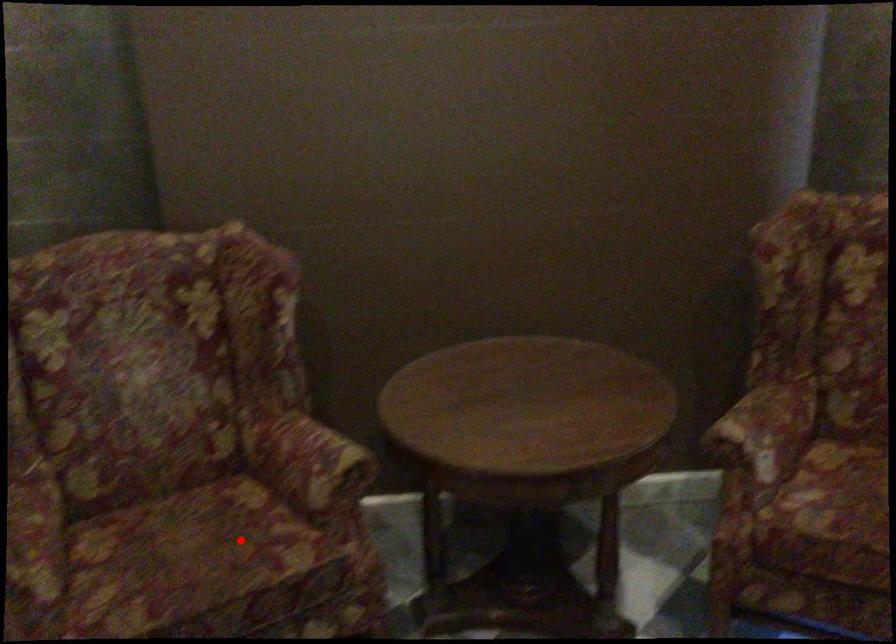
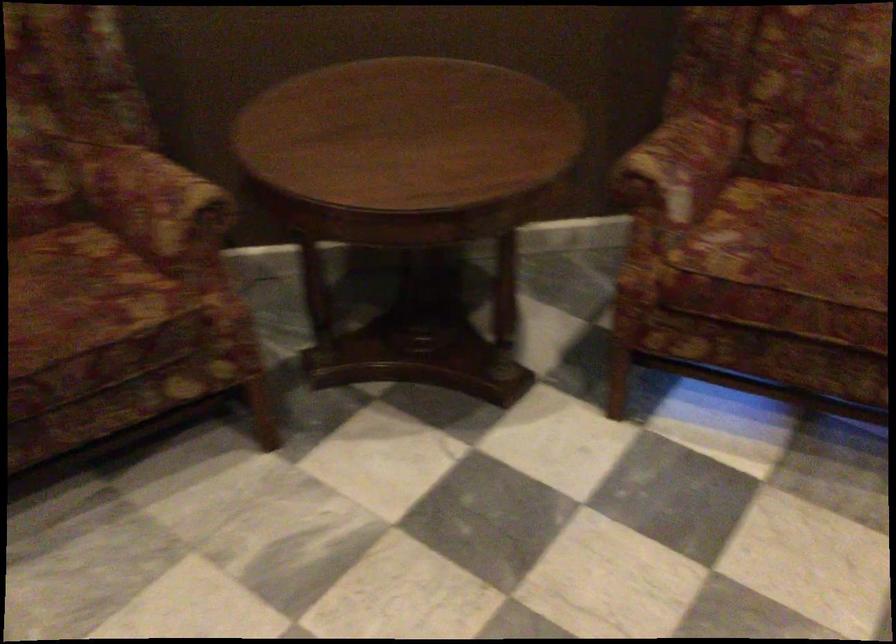
Question: I am providing you with two images of the same scene from different viewpoints. Given a red point in image1, look at the same physical point in image2. Is it:

Choices:
 (A) Closer to the viewpoint
 (B) Farther from the viewpoint

Answer: (A)